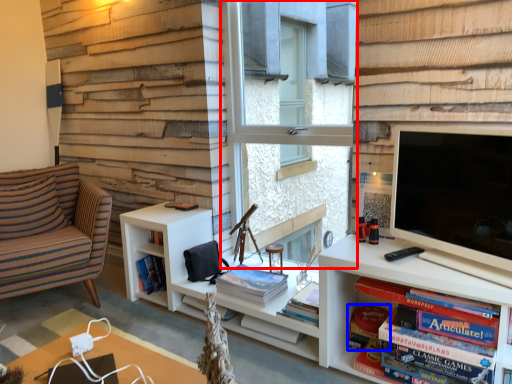
Question: Which of the following is the closest to the observer, window (highlighted by a red box) or paperback book (highlighted by a blue box)?

Choices:
 (A) window
 (B) paperback book

Answer: (B)